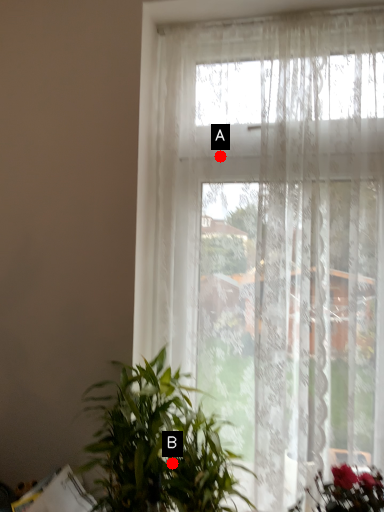
Question: Two points are circled on the image, labeled by A and B beside each circle. Which point is closer to the camera taking this photo?

Choices:
 (A) A is closer
 (B) B is closer

Answer: (B)